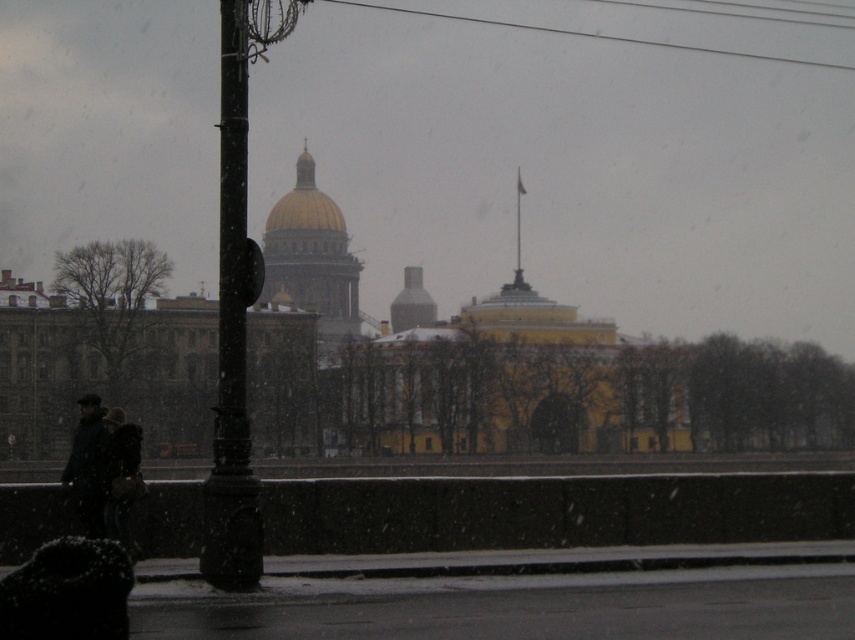
Question: Which point is farther to the camera?

Choices:
 (A) (96, 413)
 (B) (243, 230)

Answer: (A)

Question: Which object appears farthest from the camera in this image?

Choices:
 (A) black metal pole at left
 (B) dark wool coat at lower left
 (C) dark gray coat at left

Answer: (B)

Question: Observing the image, what is the correct spatial positioning of dark wool coat at lower left in reference to dark gray coat at left?

Choices:
 (A) below
 (B) above

Answer: (B)

Question: Estimate the real-world distances between objects in this image. Which object is farther from the dark wool coat at lower left?

Choices:
 (A) black metal pole at left
 (B) dark gray coat at left

Answer: (A)

Question: Can you confirm if black metal pole at left is wider than dark gray coat at left?

Choices:
 (A) no
 (B) yes

Answer: (B)

Question: Is black metal pole at left to the right of dark wool coat at lower left from the viewer's perspective?

Choices:
 (A) yes
 (B) no

Answer: (B)